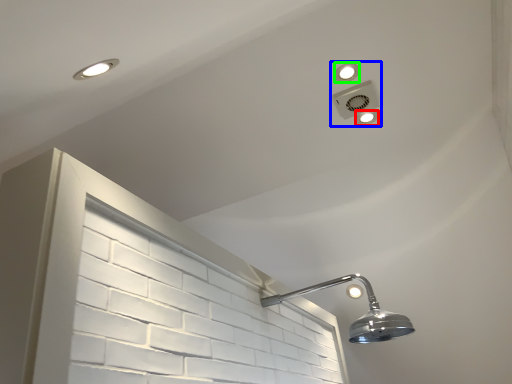
Question: Considering the real-world distances, which object is closest to dot (highlighted by a red box)? fixture (highlighted by a blue box) or dot (highlighted by a green box).

Choices:
 (A) fixture
 (B) dot

Answer: (A)